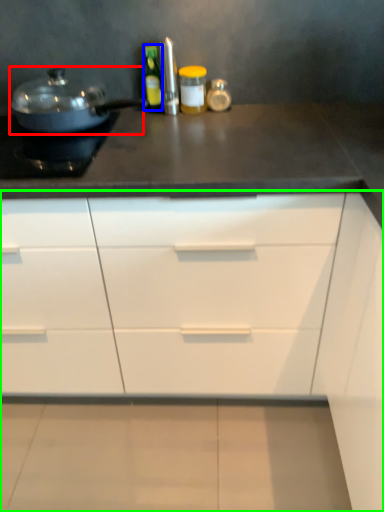
Question: Estimate the real-world distances between objects in this image. Which object is closer to kitchen appliance (highlighted by a red box), bottle (highlighted by a blue box) or cabinetry (highlighted by a green box)?

Choices:
 (A) bottle
 (B) cabinetry

Answer: (A)